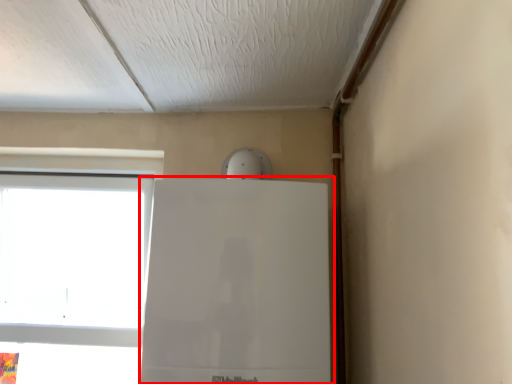
Question: From the image's perspective, where is fridge (annotated by the red box) located in relation to window in the image?

Choices:
 (A) below
 (B) above

Answer: (B)